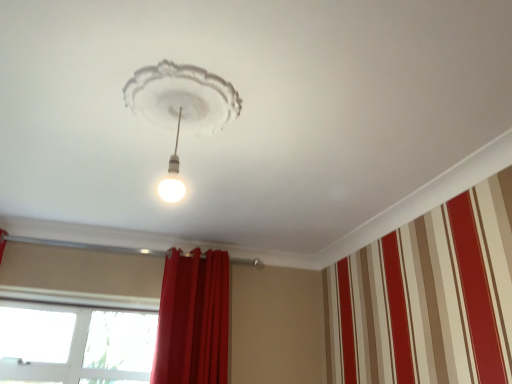
Question: Is transparent glass window at lower left in front of or behind white glossy light bulb at center in the image?

Choices:
 (A) front
 (B) behind

Answer: (B)

Question: From their relative heights in the image, would you say transparent glass window at lower left is taller or shorter than white glossy light bulb at center?

Choices:
 (A) short
 (B) tall

Answer: (B)

Question: Which object is the closest to the red velvet curtain at center?

Choices:
 (A) white glossy light bulb at center
 (B) transparent glass window at lower left

Answer: (B)

Question: Which of these objects is positioned closest to the transparent glass window at lower left?

Choices:
 (A) white glossy light bulb at center
 (B) red velvet curtain at center

Answer: (B)